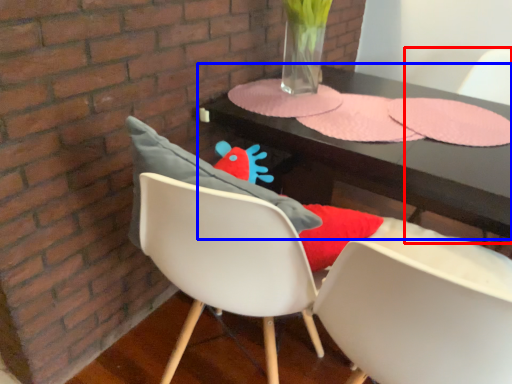
Question: Among these objects, which one is nearest to the camera, armchair (highlighted by a red box) or table (highlighted by a blue box)?

Choices:
 (A) armchair
 (B) table

Answer: (B)